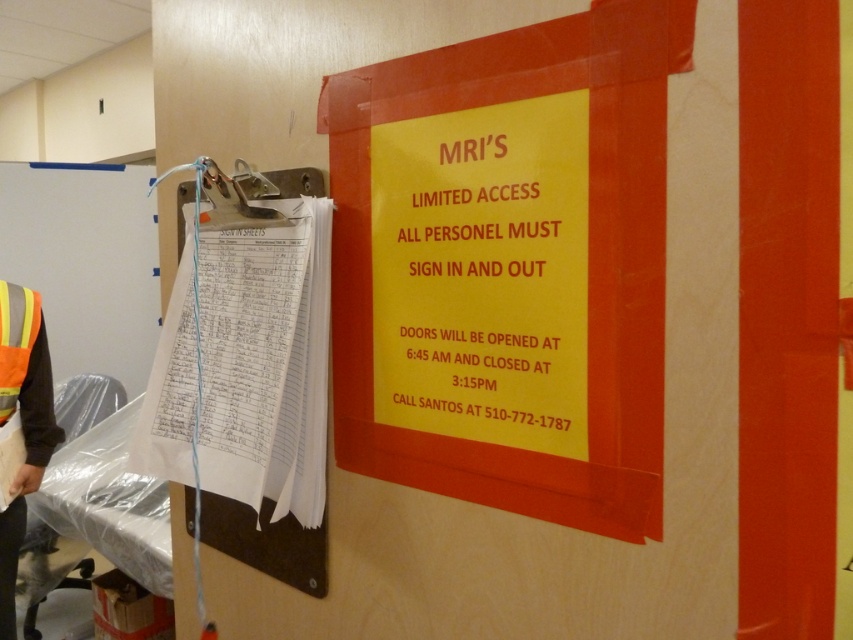
The image size is (853, 640). What do you see at coordinates (483, 273) in the screenshot?
I see `yellow paper sign at upper center` at bounding box center [483, 273].

Which is more to the right, yellow paper sign at upper center or high-visibility fabric safety vest at left?

Positioned to the right is yellow paper sign at upper center.

Image resolution: width=853 pixels, height=640 pixels. What do you see at coordinates (483, 273) in the screenshot?
I see `yellow paper sign at upper center` at bounding box center [483, 273].

Identify the location of yellow paper sign at upper center. (483, 273).